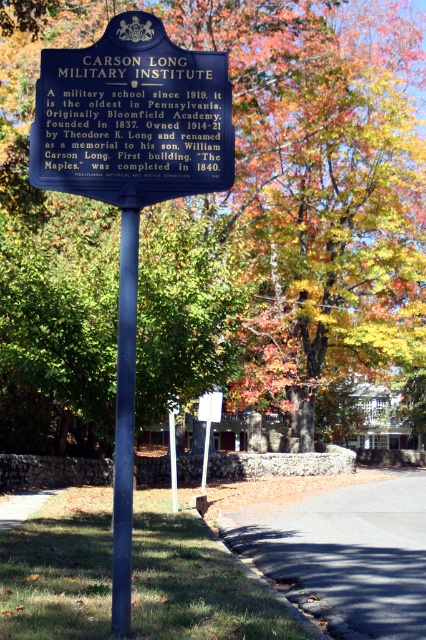
Question: Which object appears closest to the camera in this image?

Choices:
 (A) blue metallic pole at center
 (B) white plastic sign at center
 (C) green leafy tree at center
 (D) blue metal sign at center

Answer: (A)

Question: Can you confirm if blue metallic pole at center is wider than white plastic sign at center?

Choices:
 (A) yes
 (B) no

Answer: (B)

Question: Does green leafy tree at center have a smaller size compared to blue metallic pole at center?

Choices:
 (A) no
 (B) yes

Answer: (A)

Question: Which object is farther from the camera taking this photo?

Choices:
 (A) green leafy tree at center
 (B) white plastic sign at center
 (C) blue metallic pole at center

Answer: (B)

Question: Which of these objects is positioned farthest from the blue metal sign at center?

Choices:
 (A) white plastic sign at center
 (B) blue metallic pole at center
 (C) green leafy tree at center

Answer: (C)

Question: From the image, what is the correct spatial relationship of green leafy tree at center in relation to blue metal sign at center?

Choices:
 (A) below
 (B) above

Answer: (B)